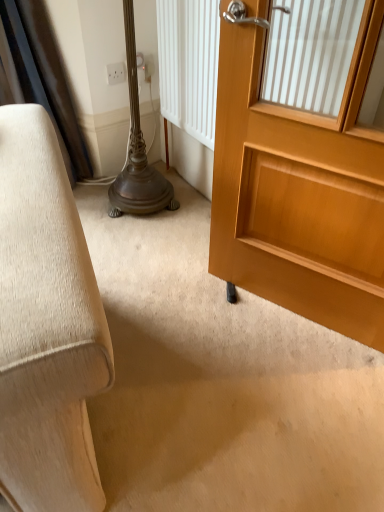
Question: Is white plastic electric outlet at upper center directly adjacent to light brown wooden door at right?

Choices:
 (A) no
 (B) yes

Answer: (A)

Question: Is white plastic electric outlet at upper center bigger than light brown wooden door at right?

Choices:
 (A) yes
 (B) no

Answer: (B)

Question: Is white plastic electric outlet at upper center to the right of light brown wooden door at right from the viewer's perspective?

Choices:
 (A) yes
 (B) no

Answer: (B)

Question: From the image's perspective, is white plastic electric outlet at upper center above light brown wooden door at right?

Choices:
 (A) no
 (B) yes

Answer: (B)

Question: Is the depth of white plastic electric outlet at upper center greater than that of light brown wooden door at right?

Choices:
 (A) no
 (B) yes

Answer: (B)

Question: Does white plastic electric outlet at upper center appear on the left side of light brown wooden door at right?

Choices:
 (A) no
 (B) yes

Answer: (B)

Question: Does light brown wooden door at right appear on the left side of white plastic electric outlet at upper center?

Choices:
 (A) no
 (B) yes

Answer: (A)

Question: Does light brown wooden door at right contain white plastic electric outlet at upper center?

Choices:
 (A) yes
 (B) no

Answer: (B)

Question: Does light brown wooden door at right have a lesser height compared to white plastic electric outlet at upper center?

Choices:
 (A) no
 (B) yes

Answer: (A)

Question: Does light brown wooden door at right have a lesser width compared to white plastic electric outlet at upper center?

Choices:
 (A) yes
 (B) no

Answer: (B)

Question: Is light brown wooden door at right outside of white plastic electric outlet at upper center?

Choices:
 (A) no
 (B) yes

Answer: (B)

Question: From the image's perspective, would you say light brown wooden door at right is positioned over white plastic electric outlet at upper center?

Choices:
 (A) yes
 (B) no

Answer: (B)

Question: From the image's perspective, is light brown wooden door at right located above or below white plastic electric outlet at upper center?

Choices:
 (A) below
 (B) above

Answer: (A)